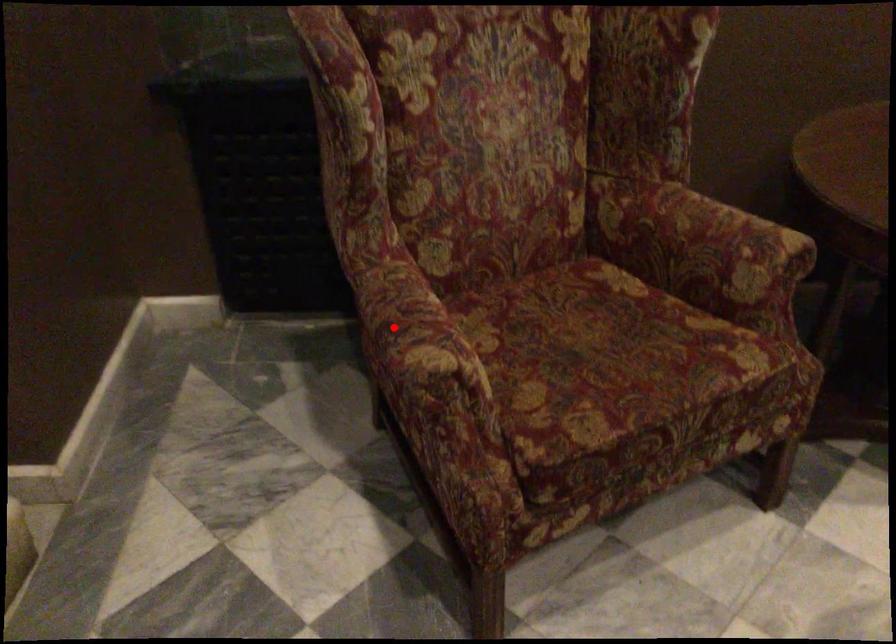
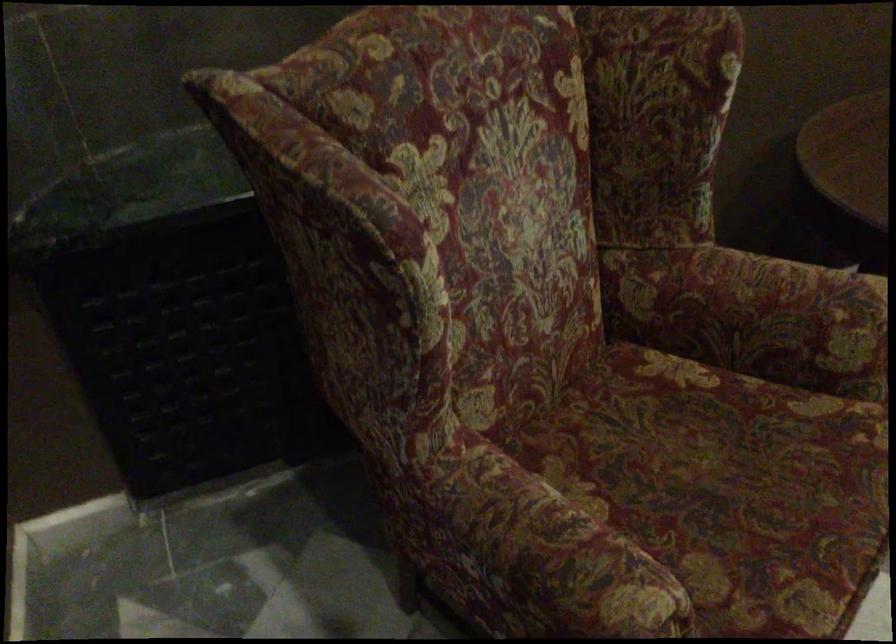
Question: I am providing you with two images of the same scene from different viewpoints. In image1, a red point is highlighted. Considering the same 3D point in image2, which of the following is correct?

Choices:
 (A) It is closer
 (B) It is farther

Answer: (A)